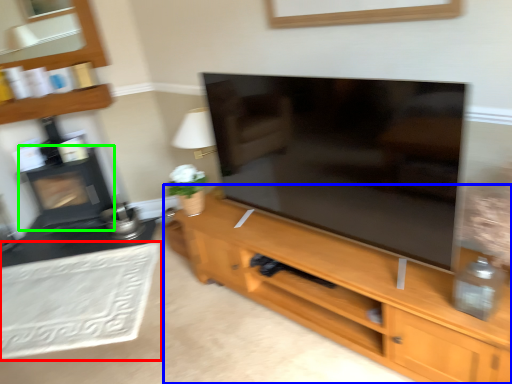
Question: Which is nearer to the plain (highlighted by a red box)? cupboard (highlighted by a blue box) or fireplace (highlighted by a green box).

Choices:
 (A) cupboard
 (B) fireplace

Answer: (B)